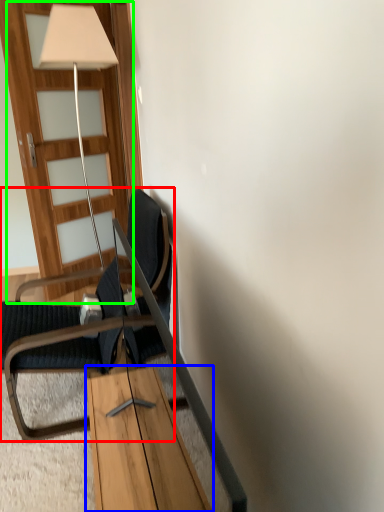
Question: Which object is positioned closest to chair (highlighted by a red box)? Select from table (highlighted by a blue box) and door (highlighted by a green box).

Choices:
 (A) table
 (B) door

Answer: (A)